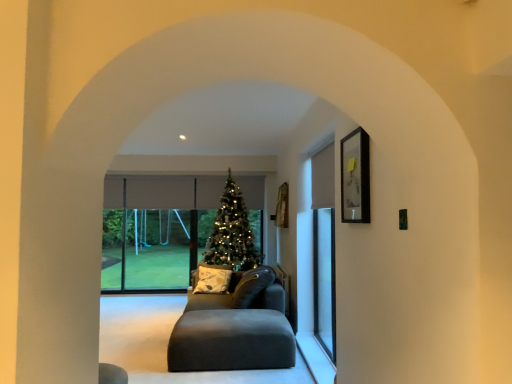
In order to face matte black picture frame at upper right, should I rotate leftwards or rightwards?

Rotate your view right by about 12.601°.

Measure the distance between matte gray couch at center and camera.

matte gray couch at center is 14.88 feet away from camera.

At what (x,y) coordinates should I click in order to perform the action: click on yellow-green printed cushion at center. Please return your answer as a coordinate pair (x, y). This screenshot has width=512, height=384. Looking at the image, I should click on (212, 278).

Where is `matte black picture frame at upper right`? Image resolution: width=512 pixels, height=384 pixels. matte black picture frame at upper right is located at coordinates (355, 177).

Can you confirm if yellow-green printed cushion at center is positioned to the right of clear glass screen door at right?

No.

Is yellow-green printed cushion at center bigger than clear glass screen door at right?

No.

Is yellow-green printed cushion at center facing towards clear glass screen door at right?

No, yellow-green printed cushion at center is not facing towards clear glass screen door at right.

Which is farther, (x=342, y=221) or (x=314, y=318)?

The point (x=314, y=318) is farther.

Does matte black picture frame at upper right turn towards clear glass screen door at right?

No, matte black picture frame at upper right is not facing towards clear glass screen door at right.

Which of these two, matte black picture frame at upper right or clear glass screen door at right, stands shorter?

Standing shorter between the two is matte black picture frame at upper right.

From a real-world perspective, is clear glass screen door at right above or below matte black ottoman at center?

clear glass screen door at right is situated higher than matte black ottoman at center in the real world.

Considering the relative positions of clear glass screen door at right and matte black ottoman at center in the image provided, is clear glass screen door at right to the left of matte black ottoman at center from the viewer's perspective?

No, clear glass screen door at right is not to the left of matte black ottoman at center.

Is clear glass screen door at right oriented towards matte black ottoman at center?

Yes, clear glass screen door at right is facing matte black ottoman at center.

Is clear glass screen door at right oriented towards green matte christmas tree at center?

No, clear glass screen door at right is not turned towards green matte christmas tree at center.

Between point (322, 252) and point (231, 216), which one is positioned behind?

The point (231, 216) is farther from the camera.

Locate an element on the screen. The width and height of the screenshot is (512, 384). screen door in front of the green matte christmas tree at center is located at coordinates (324, 249).

Does matte gray couch at center contain yellow-green printed cushion at center?

Yes, matte gray couch at center contains yellow-green printed cushion at center.

Is matte gray couch at center far away from yellow-green printed cushion at center?

matte gray couch at center is near yellow-green printed cushion at center, not far away.

Does matte gray couch at center lie in front of yellow-green printed cushion at center?

Yes, it is.

Which object is positioned more to the left, matte gray couch at center or yellow-green printed cushion at center?

From the viewer's perspective, yellow-green printed cushion at center appears more on the left side.

From the picture: Is there a large distance between yellow-green printed cushion at center and matte black picture frame at upper right?

Yes, yellow-green printed cushion at center is far from matte black picture frame at upper right.

Based on the photo, does yellow-green printed cushion at center have a lesser height compared to matte black picture frame at upper right?

No, yellow-green printed cushion at center is not shorter than matte black picture frame at upper right.

Is yellow-green printed cushion at center spatially inside matte black picture frame at upper right, or outside of it?

yellow-green printed cushion at center is spatially situated outside matte black picture frame at upper right.

This screenshot has width=512, height=384. Find the location of `picture frame above the yellow-green printed cushion at center (from the image's perspective)`. picture frame above the yellow-green printed cushion at center (from the image's perspective) is located at coordinates [x=355, y=177].

Is green matte christmas tree at center touching clear glass screen door at right?

No.

Is clear glass screen door at right inside green matte christmas tree at center?

Actually, clear glass screen door at right is outside green matte christmas tree at center.

Locate an element on the screen. pillow located on the left of clear glass screen door at right is located at coordinates tap(212, 278).

Image resolution: width=512 pixels, height=384 pixels. I want to click on picture frame that is above the clear glass screen door at right (from a real-world perspective), so click(355, 177).

Which object lies nearer to the anchor point matte black ottoman at center, clear glass screen door at right or matte gray couch at center?

Among the two, matte gray couch at center is located nearer to matte black ottoman at center.

From the image, which object appears to be farther from matte black ottoman at center, matte black picture frame at upper right or yellow-green printed cushion at center?

matte black picture frame at upper right lies further to matte black ottoman at center than the other object.

When comparing their distances from clear glass screen door at right, does matte black picture frame at upper right or green matte christmas tree at center seem closer?

green matte christmas tree at center is positioned closer to the anchor clear glass screen door at right.

Based on their spatial positions, is green matte christmas tree at center or matte black picture frame at upper right further from matte black ottoman at center?

Based on the image, matte black picture frame at upper right appears to be further to matte black ottoman at center.

Which object lies nearer to the anchor point matte gray couch at center, yellow-green printed cushion at center or clear glass screen door at right?

Among the two, yellow-green printed cushion at center is located nearer to matte gray couch at center.

Which object lies further to the anchor point matte black picture frame at upper right, green matte christmas tree at center or clear glass screen door at right?

green matte christmas tree at center lies further to matte black picture frame at upper right than the other object.

Considering their positions, is clear glass screen door at right positioned closer to matte black ottoman at center than yellow-green printed cushion at center?

Based on the image, yellow-green printed cushion at center appears to be nearer to matte black ottoman at center.

Looking at the image, which one is located closer to green matte christmas tree at center, matte gray couch at center or matte black picture frame at upper right?

Based on the image, matte gray couch at center appears to be nearer to green matte christmas tree at center.

Find the location of `screen door positioned between matte black picture frame at upper right and green matte christmas tree at center from near to far`. screen door positioned between matte black picture frame at upper right and green matte christmas tree at center from near to far is located at coordinates (324, 249).

At what (x,y) coordinates should I click in order to perform the action: click on pillow positioned between matte gray couch at center and green matte christmas tree at center from near to far. Please return your answer as a coordinate pair (x, y). The height and width of the screenshot is (384, 512). Looking at the image, I should click on (212, 278).

Locate an element on the screen. This screenshot has width=512, height=384. couch positioned between matte black ottoman at center and green matte christmas tree at center from near to far is located at coordinates (244, 293).

Find the location of a particular element. The width and height of the screenshot is (512, 384). screen door positioned between matte black picture frame at upper right and matte gray couch at center from near to far is located at coordinates (324, 249).